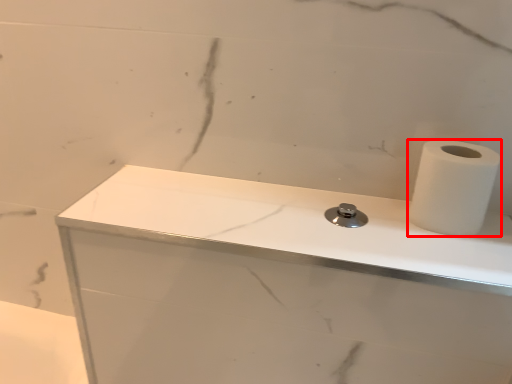
Question: Considering the relative positions of paper towel (annotated by the red box) and counter top in the image provided, where is paper towel (annotated by the red box) located with respect to the staircase?

Choices:
 (A) right
 (B) left

Answer: (A)